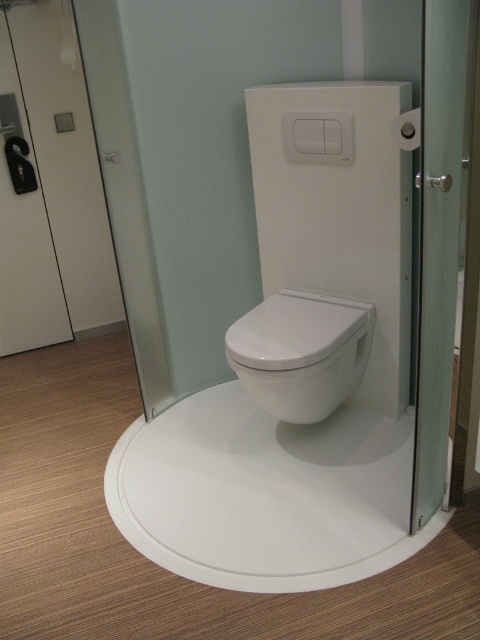
Question: Among these objects, which one is nearest to the camera?

Choices:
 (A) white glossy toilet at center
 (B) white glossy toilet seat at center
 (C) transparent glass screen door at right

Answer: (C)

Question: Among these points, which one is farthest from the camera?

Choices:
 (A) (444, 72)
 (B) (332, 355)

Answer: (B)

Question: Can you confirm if white glossy toilet seat at center is positioned to the left of transparent glass screen door at right?

Choices:
 (A) yes
 (B) no

Answer: (A)

Question: Observing the image, what is the correct spatial positioning of white glossy toilet seat at center in reference to white glossy toilet at center?

Choices:
 (A) right
 (B) left

Answer: (A)

Question: Does transparent glass screen door at right appear on the right side of white glossy toilet at center?

Choices:
 (A) yes
 (B) no

Answer: (A)

Question: Which point appears farthest from the camera in this image?

Choices:
 (A) (420, 484)
 (B) (292, 161)

Answer: (B)